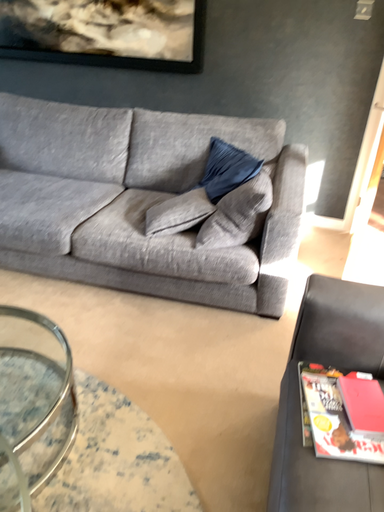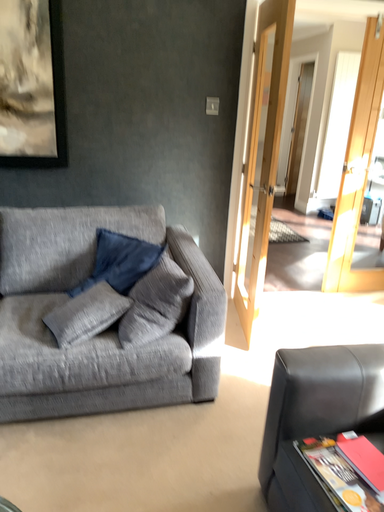
Question: How did the camera likely rotate when shooting the video?

Choices:
 (A) rotated downward
 (B) rotated upward

Answer: (B)